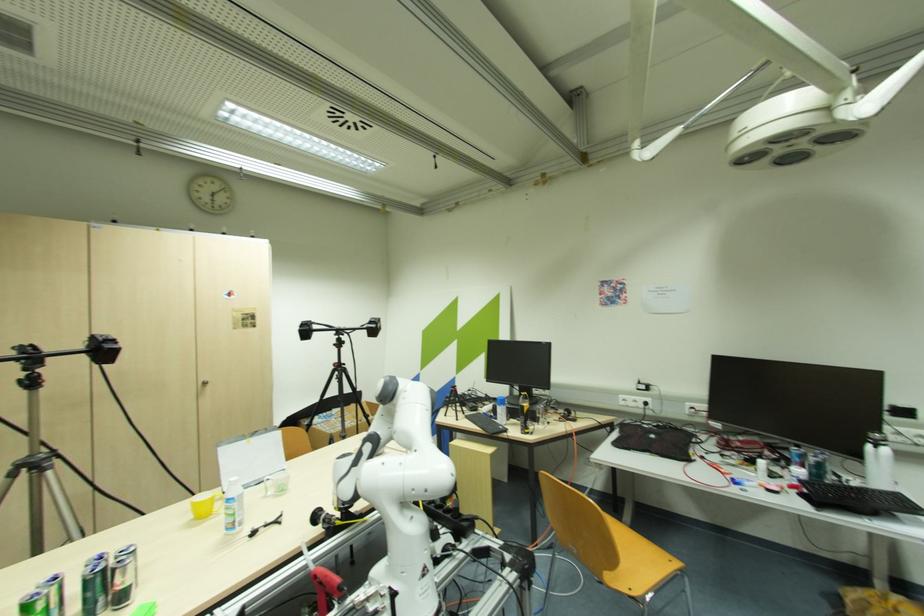
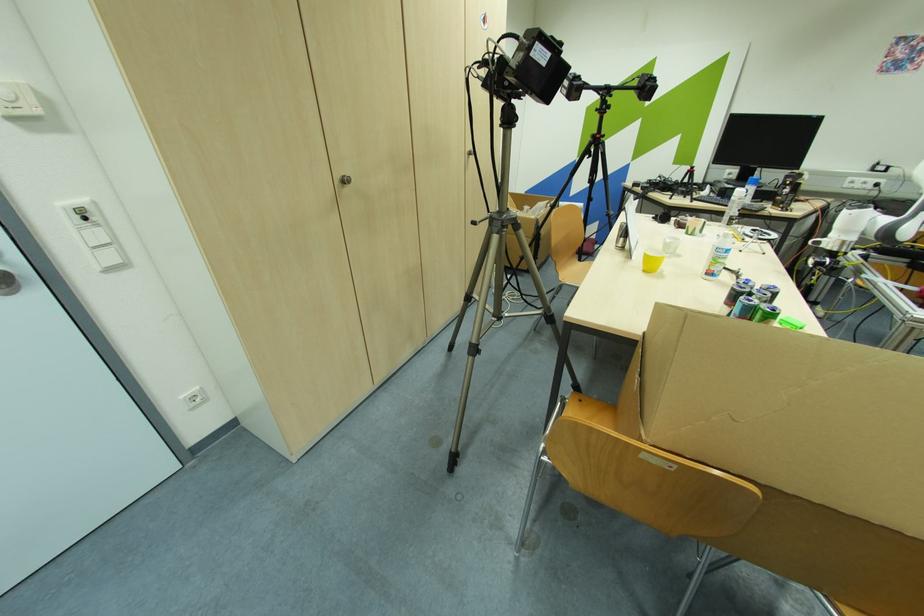
The point at (35, 455) is marked in the first image. Where is the corresponding point in the second image?

(504, 214)